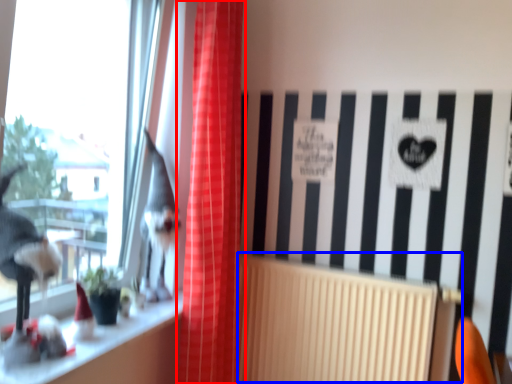
Question: Which of the following is the farthest to the observer, curtain (highlighted by a red box) or radiator (highlighted by a blue box)?

Choices:
 (A) curtain
 (B) radiator

Answer: (B)